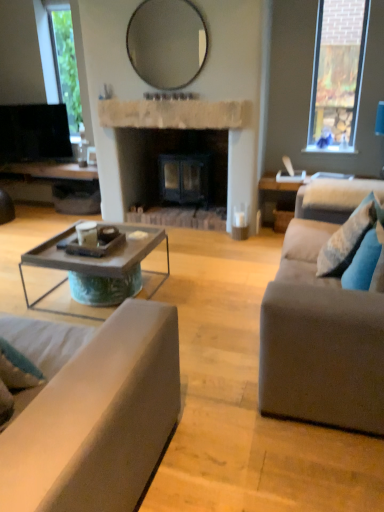
How much space does matte gray couch at lower left, the first studio couch when ordered from left to right, occupy horizontally?

matte gray couch at lower left, the first studio couch when ordered from left to right, is 1.23 meters in width.

Where is `blue textured pillow at right, arranged as the 1th pillow when viewed from the back`? Image resolution: width=384 pixels, height=512 pixels. blue textured pillow at right, arranged as the 1th pillow when viewed from the back is located at coordinates (348, 238).

What is the approximate width of gray fabric couch at right, which is the 1th studio couch in right-to-left order?

It is 34.10 inches.

This screenshot has width=384, height=512. Identify the location of black glossy television at upper left. (34, 133).

What is the approximate width of matte glass mirror at upper center?

matte glass mirror at upper center is 3.26 inches wide.

Find the location of a particular element. The image size is (384, 512). white stone fireplace at center is located at coordinates (174, 114).

Locate an element on the screen. This screenshot has width=384, height=512. matte gray couch at lower left, which appears as the second studio couch when viewed from the right is located at coordinates (98, 419).

How many degrees apart are the facing directions of matte glass mirror at upper center and black glossy television at upper left?

23.7 degrees separate the facing orientations of matte glass mirror at upper center and black glossy television at upper left.

Which point is more distant from viewer, (194, 63) or (0, 111)?

The point (0, 111) is farther.

Is matte glass mirror at upper center next to black glossy television at upper left?

matte glass mirror at upper center is not next to black glossy television at upper left, and they're not touching.

From the image's perspective, would you say matte glass mirror at upper center is shown under black glossy television at upper left?

Actually, matte glass mirror at upper center appears above black glossy television at upper left in the image.

In the image, is gray fabric couch at right, placed as the second studio couch when sorted from left to right, positioned in front of or behind white stone fireplace at center?

Visually, gray fabric couch at right, placed as the second studio couch when sorted from left to right, is located in front of white stone fireplace at center.

Considering the sizes of gray fabric couch at right, which is the 1th studio couch in right-to-left order, and white stone fireplace at center in the image, is gray fabric couch at right, which is the 1th studio couch in right-to-left order, wider or thinner than white stone fireplace at center?

Clearly, gray fabric couch at right, which is the 1th studio couch in right-to-left order, has more width compared to white stone fireplace at center.

Between gray fabric couch at right, placed as the second studio couch when sorted from left to right, and white stone fireplace at center, which one has more height?

Standing taller between the two is gray fabric couch at right, placed as the second studio couch when sorted from left to right.

Considering the positions of objects gray fabric couch at right, placed as the second studio couch when sorted from left to right, and white stone fireplace at center in the image provided, who is more to the right, gray fabric couch at right, placed as the second studio couch when sorted from left to right, or white stone fireplace at center?

Positioned to the right is gray fabric couch at right, placed as the second studio couch when sorted from left to right.

Between black glossy television at upper left and rustic wood coffee table at center, which one is positioned behind?

black glossy television at upper left is further away from the camera.

Is black glossy television at upper left directly adjacent to rustic wood coffee table at center?

black glossy television at upper left and rustic wood coffee table at center are clearly separated.

Is point (57, 126) behind point (94, 267)?

Yes, point (57, 126) is behind point (94, 267).

Between gray fabric couch at right, placed as the second studio couch when sorted from left to right, and matte glass mirror at upper center, which one has smaller width?

matte glass mirror at upper center.

Is the position of gray fabric couch at right, which is the 1th studio couch in right-to-left order, more distant than that of matte glass mirror at upper center?

No, it is in front of matte glass mirror at upper center.

Which of these two, gray fabric couch at right, which is the 1th studio couch in right-to-left order, or matte glass mirror at upper center, stands shorter?

With less height is matte glass mirror at upper center.

From a real-world perspective, which is physically above, gray fabric couch at right, placed as the second studio couch when sorted from left to right, or matte glass mirror at upper center?

In real-world perspective, matte glass mirror at upper center is above.

From the blue textured pillow at right, which is counted as the second pillow, starting from the front, count the 2nd studio couch to the left and point to it. Please provide its 2D coordinates.

[(98, 419)]

Is point (382, 211) farther from viewer compared to point (150, 454)?

Yes.

Is blue textured pillow at right, which is counted as the second pillow, starting from the front, in front of or behind matte gray couch at lower left, which appears as the second studio couch when viewed from the right, in the image?

Visually, blue textured pillow at right, which is counted as the second pillow, starting from the front, is located behind matte gray couch at lower left, which appears as the second studio couch when viewed from the right.

Considering the sizes of objects blue textured pillow at right, which is counted as the second pillow, starting from the front, and matte gray couch at lower left, the first studio couch when ordered from left to right, in the image provided, who is bigger, blue textured pillow at right, which is counted as the second pillow, starting from the front, or matte gray couch at lower left, the first studio couch when ordered from left to right,?

With larger size is matte gray couch at lower left, the first studio couch when ordered from left to right.

From a real-world perspective, is blue fabric pillow at right, the 2th pillow from the back, on top of rustic wood coffee table at center?

Yes, from a real-world perspective, blue fabric pillow at right, the 2th pillow from the back, is over rustic wood coffee table at center

Is blue fabric pillow at right, which is counted as the 1th pillow, starting from the front, not within rustic wood coffee table at center?

Yes.

Does blue fabric pillow at right, the 2th pillow from the back, lie behind rustic wood coffee table at center?

No, blue fabric pillow at right, the 2th pillow from the back, is closer to the viewer.

Considering the positions of objects blue fabric pillow at right, which is counted as the 1th pillow, starting from the front, and blue textured pillow at right, which is counted as the second pillow, starting from the front, in the image provided, who is behind, blue fabric pillow at right, which is counted as the 1th pillow, starting from the front, or blue textured pillow at right, which is counted as the second pillow, starting from the front,?

blue textured pillow at right, which is counted as the second pillow, starting from the front, is more distant.

Find the location of a particular element. This screenshot has height=512, width=384. pillow located in front of the blue textured pillow at right, arranged as the 1th pillow when viewed from the back is located at coordinates (363, 263).

Which is closer to the camera, (x=343, y=278) or (x=341, y=263)?

Point (x=343, y=278) is closer to the camera than point (x=341, y=263).

From a real-world perspective, who is located lower, blue fabric pillow at right, the 2th pillow from the back, or blue textured pillow at right, arranged as the 1th pillow when viewed from the back?

blue fabric pillow at right, the 2th pillow from the back.

In order to click on television that appears below the matte glass mirror at upper center (from the image's perspective) in this screenshot , I will do `click(34, 133)`.

At what (x,y) coordinates should I click in order to perform the action: click on mantle above the gray fabric couch at right, placed as the second studio couch when sorted from left to right (from a real-world perspective). Please return your answer as a coordinate pair (x, y). Image resolution: width=384 pixels, height=512 pixels. Looking at the image, I should click on (174, 114).

From the image, which object appears to be nearer to gray fabric couch at right, placed as the second studio couch when sorted from left to right, rustic wood coffee table at center or matte gray couch at lower left, which appears as the second studio couch when viewed from the right?

The object closer to gray fabric couch at right, placed as the second studio couch when sorted from left to right, is matte gray couch at lower left, which appears as the second studio couch when viewed from the right.

When comparing their distances from blue fabric pillow at right, the 2th pillow from the back, does matte gray couch at lower left, the first studio couch when ordered from left to right, or black glossy television at upper left seem further?

Based on the image, black glossy television at upper left appears to be further to blue fabric pillow at right, the 2th pillow from the back.

Based on their spatial positions, is blue fabric pillow at right, the 2th pillow from the back, or matte gray couch at lower left, which appears as the second studio couch when viewed from the right, closer to black glossy television at upper left?

blue fabric pillow at right, the 2th pillow from the back.

Looking at the image, which one is located further to matte glass mirror at upper center, blue textured pillow at right, arranged as the 1th pillow when viewed from the back, or blue fabric pillow at right, which is counted as the 1th pillow, starting from the front?

The object further to matte glass mirror at upper center is blue fabric pillow at right, which is counted as the 1th pillow, starting from the front.

From the image, which object appears to be nearer to rustic wood coffee table at center, matte gray couch at lower left, the first studio couch when ordered from left to right, or matte glass mirror at upper center?

matte gray couch at lower left, the first studio couch when ordered from left to right, lies closer to rustic wood coffee table at center than the other object.

When comparing their distances from blue textured pillow at right, arranged as the 1th pillow when viewed from the back, does black glossy television at upper left or blue fabric pillow at right, the 2th pillow from the back, seem closer?

Based on the image, blue fabric pillow at right, the 2th pillow from the back, appears to be nearer to blue textured pillow at right, arranged as the 1th pillow when viewed from the back.

From the image, which object appears to be nearer to matte gray couch at lower left, the first studio couch when ordered from left to right, matte glass mirror at upper center or blue fabric pillow at right, which is counted as the 1th pillow, starting from the front?

blue fabric pillow at right, which is counted as the 1th pillow, starting from the front.

Estimate the real-world distances between objects in this image. Which object is further from matte glass mirror at upper center, blue fabric pillow at right, the 2th pillow from the back, or white stone fireplace at center?

blue fabric pillow at right, the 2th pillow from the back, is further to matte glass mirror at upper center.

Where is `coffee table located between matte gray couch at lower left, the first studio couch when ordered from left to right, and white stone fireplace at center in the depth direction`? coffee table located between matte gray couch at lower left, the first studio couch when ordered from left to right, and white stone fireplace at center in the depth direction is located at coordinates 99,263.

Where is `studio couch between rustic wood coffee table at center and blue textured pillow at right, arranged as the 1th pillow when viewed from the back, in the horizontal direction`? This screenshot has height=512, width=384. studio couch between rustic wood coffee table at center and blue textured pillow at right, arranged as the 1th pillow when viewed from the back, in the horizontal direction is located at coordinates (320, 341).

The width and height of the screenshot is (384, 512). Identify the location of studio couch between matte gray couch at lower left, which appears as the second studio couch when viewed from the right, and white stone fireplace at center from front to back. (320, 341).

The image size is (384, 512). I want to click on studio couch between matte glass mirror at upper center and rustic wood coffee table at center from top to bottom, so click(x=320, y=341).